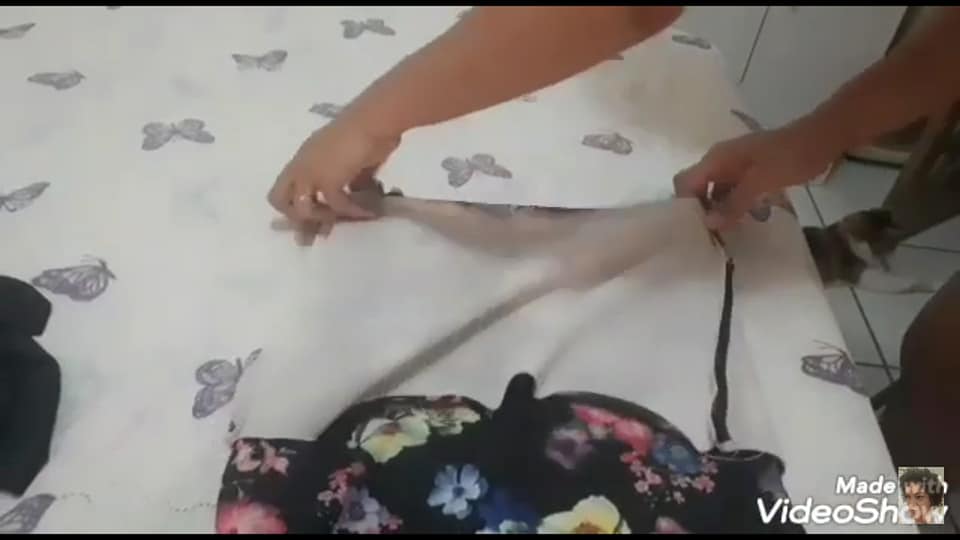
Locate an element on the screen. tiles of floor is located at coordinates (x=889, y=305), (x=846, y=316), (x=850, y=199), (x=806, y=208), (x=869, y=379), (x=890, y=374).